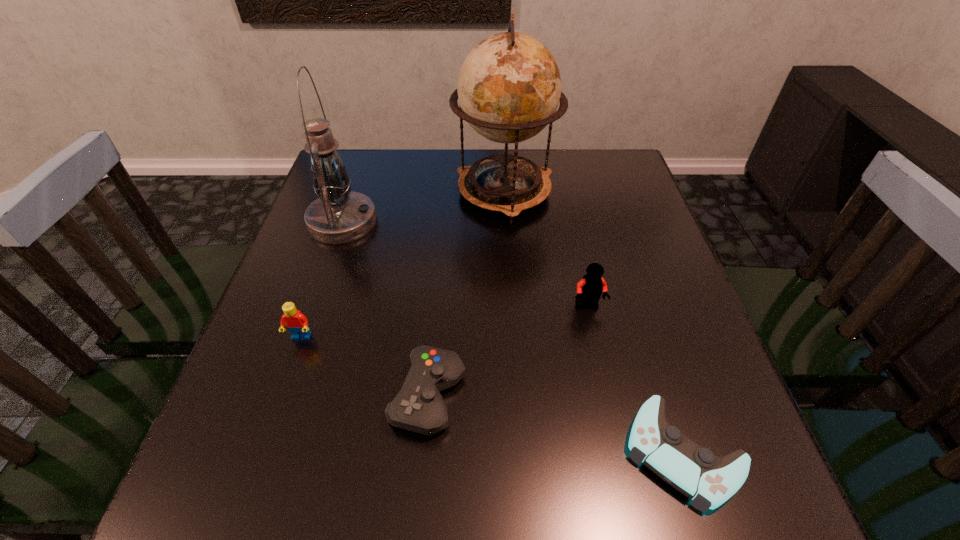
The height and width of the screenshot is (540, 960). I want to click on vacant space situated 0.290m at the center of the globe, so click(513, 316).

Locate an element on the screen. vacant space situated on the back of the oil lamp is located at coordinates (366, 153).

Locate an element on the screen. vacant space located 0.220m on the front-facing side of the farther Lego is located at coordinates (612, 416).

Where is `vacant space located on the face of the left Lego`? vacant space located on the face of the left Lego is located at coordinates (251, 484).

The height and width of the screenshot is (540, 960). What are the coordinates of `vacant area located 0.270m on the right of the left control` in the screenshot? It's located at (619, 396).

You are a GUI agent. You are given a task and a screenshot of the screen. Output one action in this format:
    pyautogui.click(x=<x>, y=<y>)
    Task: Click on the free region located 0.300m on the left of the right control
    This screenshot has width=960, height=540.
    Given the screenshot: What is the action you would take?
    pyautogui.click(x=440, y=453)

Identify the location of object present at the far edge. 509,87.

Image resolution: width=960 pixels, height=540 pixels. Identify the location of object present at the near edge. (709, 480).

Image resolution: width=960 pixels, height=540 pixels. Identify the location of oil lamp present at the left edge. (339, 215).

This screenshot has width=960, height=540. I want to click on Lego that is positioned at the left edge, so click(x=297, y=324).